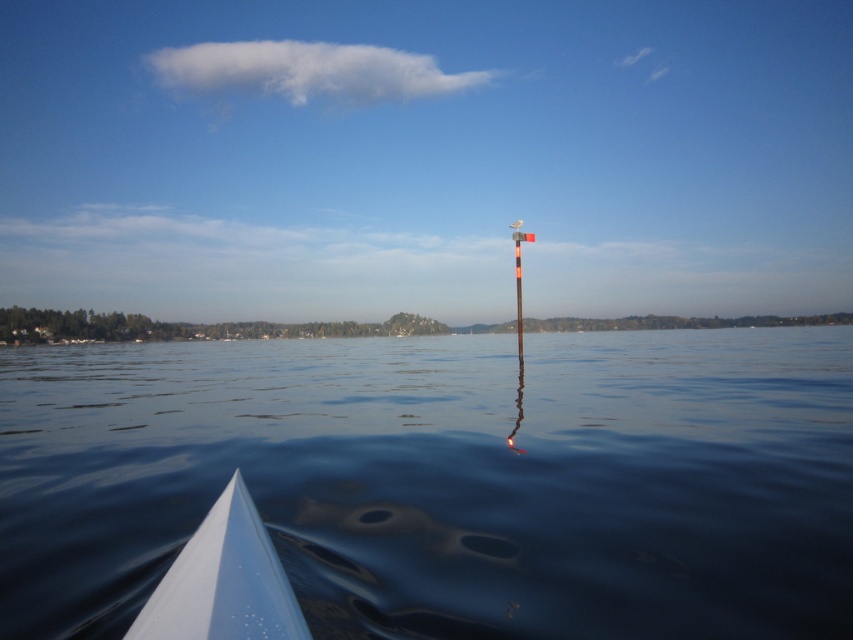
Can you confirm if transparent water at center is smaller than white glossy boat at lower left?

Incorrect, transparent water at center is not smaller in size than white glossy boat at lower left.

Does point (834, 410) lie behind point (167, 592)?

Yes, it is behind point (167, 592).

The width and height of the screenshot is (853, 640). Identify the location of transparent water at center. (445, 480).